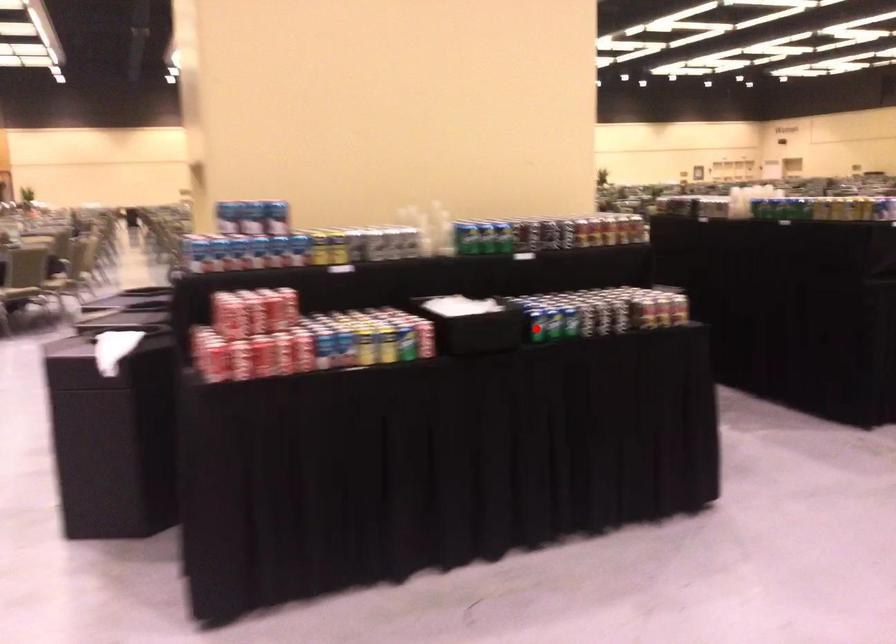
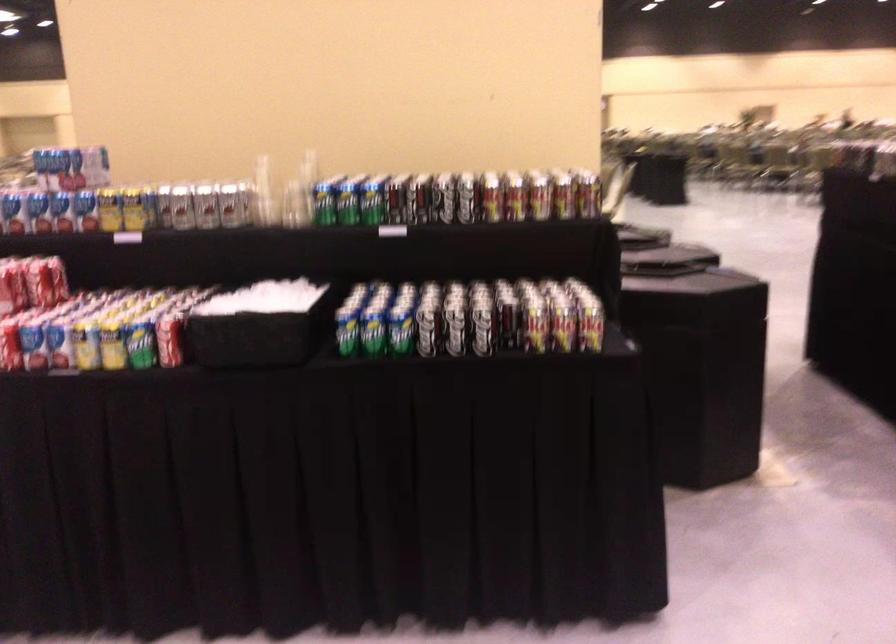
Locate, in the second image, the point that corresponds to the highlighted location in the first image.

(347, 337)